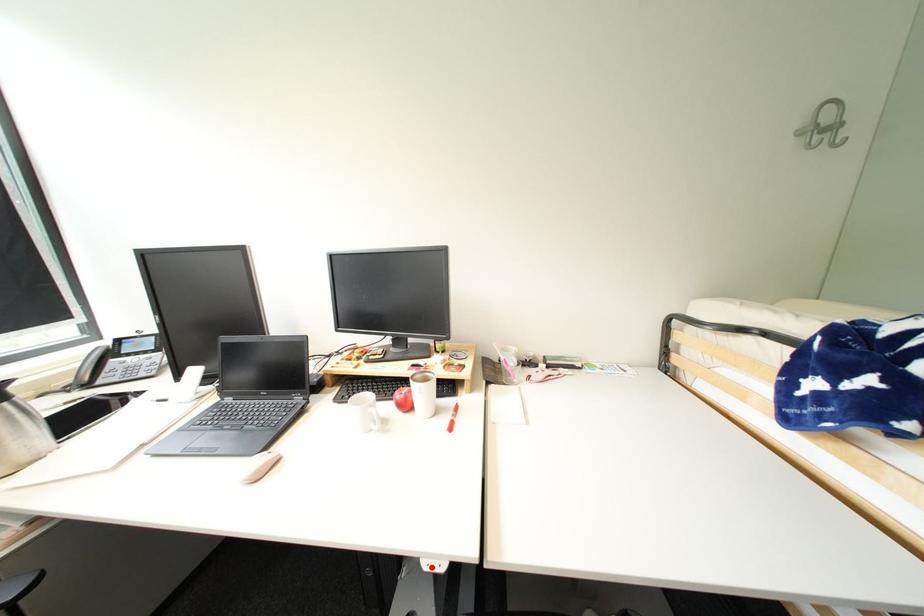
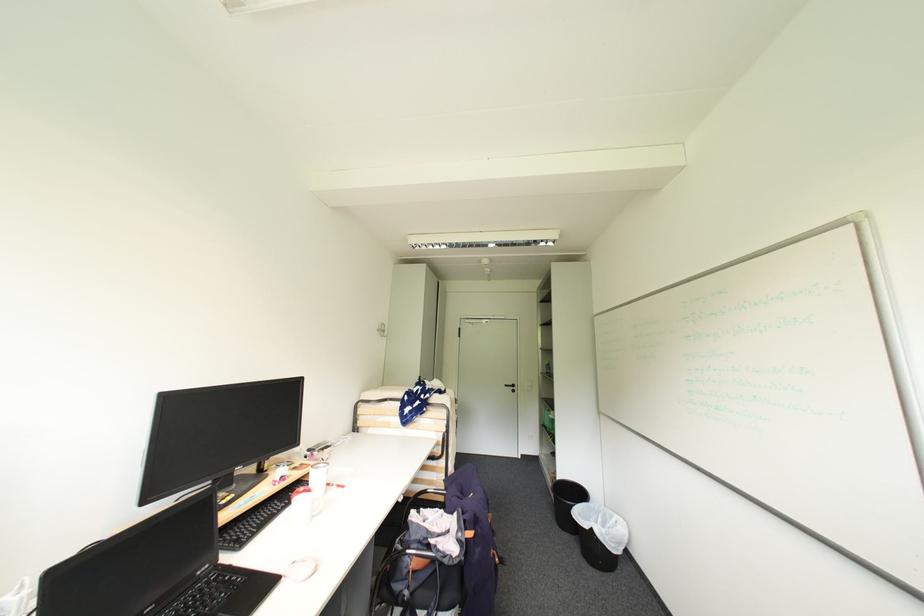
Where in the second image is the point corresponding to the highlighted location from the first image?

(407, 501)